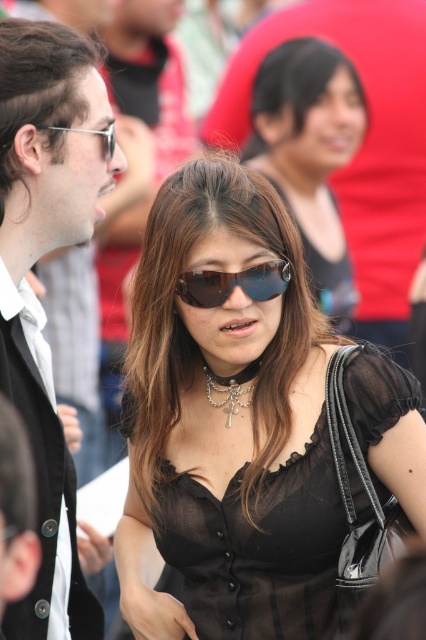
You are a photographer trying to capture a closeup of the sunglasses at center and the matte silver goggles at upper left. Which object should you zoom in more on to ensure both are clearly visible in the photo?

The sunglasses at center is bigger than matte silver goggles at upper left, so you should zoom in more on the matte silver goggles at upper left to ensure both are clearly visible in the photo.

What is located at the coordinate point (x=31, y=291) in the image?

The matte black jacket at left is located at the coordinate point (x=31, y=291).

You are a photographer trying to capture a closeup of the sunglasses at center and the matte silver goggles at upper left in the scene. Which object should you zoom in on first to ensure it appears larger in the photo?

The sunglasses at center is taller than the matte silver goggles at upper left, so you should zoom in on the sunglasses at center first to ensure it appears larger in the photo.